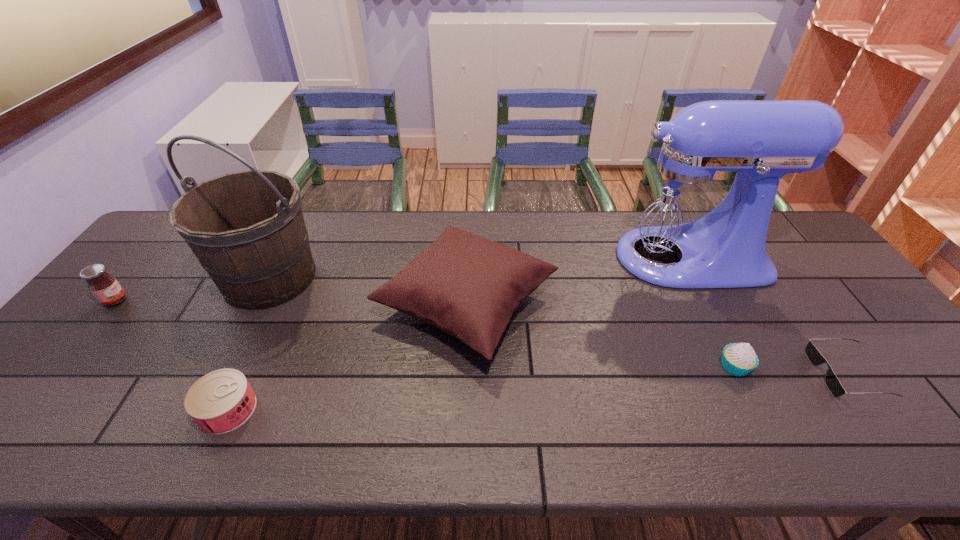
Identify the location of vacant position in the image that satisfies the following two spatial constraints: 1. on the front-facing side of the sunglasses; 2. on the front side of the sixth tallest object. (872, 409).

I want to click on free space that satisfies the following two spatial constraints: 1. on the label side of the jam; 2. on the left side of the cupcake, so tap(60, 366).